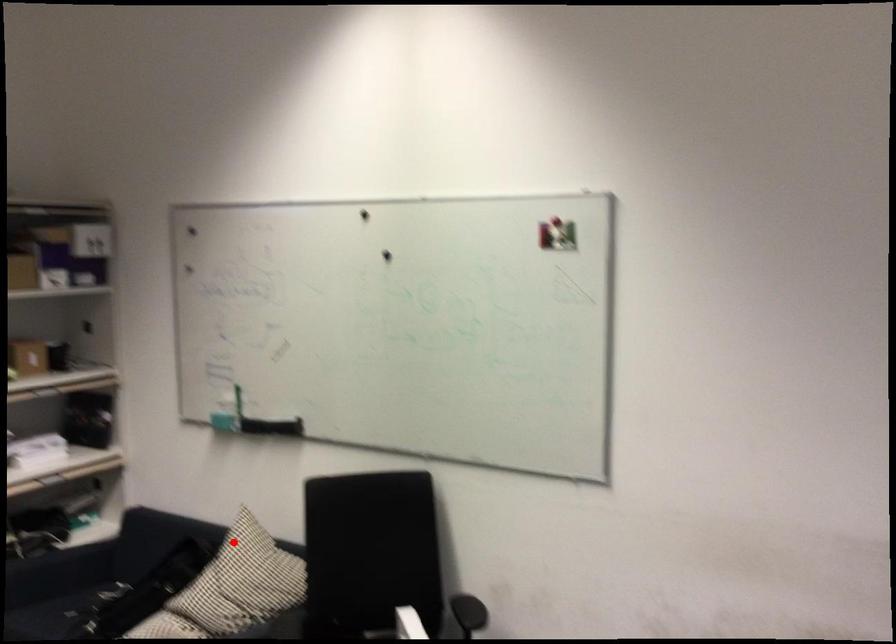
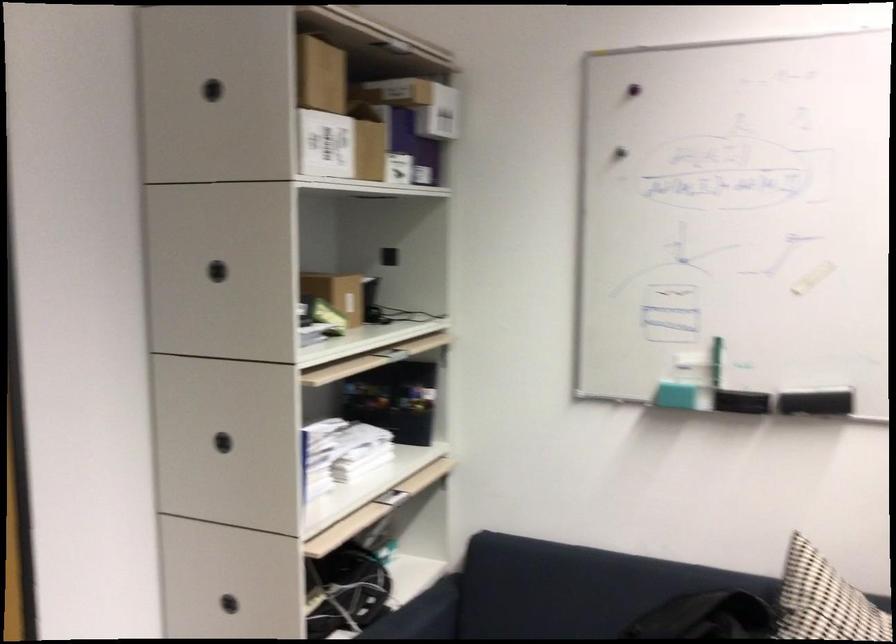
Question: I am providing you with two images of the same scene from different viewpoints. In image1, a red point is highlighted. Considering the same 3D point in image2, which of the following is correct?

Choices:
 (A) It is closer
 (B) It is farther

Answer: (A)